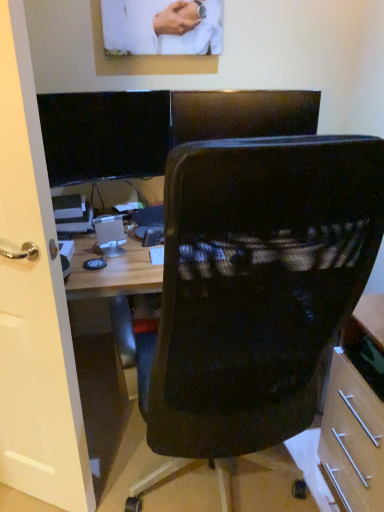
Question: From the image's perspective, is white glossy door at left located above or below black glossy monitor at upper left?

Choices:
 (A) below
 (B) above

Answer: (A)

Question: Is point (59, 505) positioned closer to the camera than point (56, 99)?

Choices:
 (A) farther
 (B) closer

Answer: (B)

Question: Which object is the closest to the black mesh chair at center?

Choices:
 (A) white glossy door at left
 (B) black glossy monitor at upper left

Answer: (A)

Question: Estimate the real-world distances between objects in this image. Which object is closer to the black mesh chair at center?

Choices:
 (A) black glossy monitor at upper left
 (B) white glossy door at left

Answer: (B)